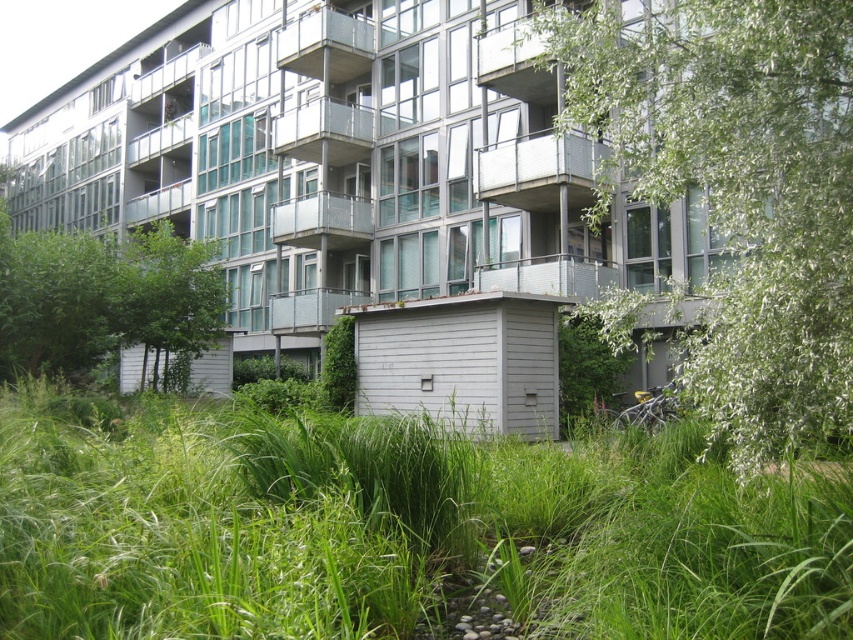
You are standing in front of the modern multi story building and want to walk to the small rectangular single story structure. As you look at the green grass at center and the green leafy tree at center, which object is closer to the ground?

The green grass at center is closer to the ground because it is positioned below the green leafy tree at center.

You are a landscape architect planning to install a 10 feet long walkway between the green leafy tree at left and the green leafy tree at center. Based on the scene, will the walkway fit between them without needing to move either tree?

The distance between the green leafy tree at left and green leafy tree at center is 9.60 feet. Since the walkway is 10 feet long, it will not fit between them without moving at least one of the trees.

You are standing at the entrance of the multi story building and want to reach the green grass at center. Which direction should you walk to get there?

The green grass at center is located at point (392, 531), so you should walk forward from the entrance of the multi story building to reach it.